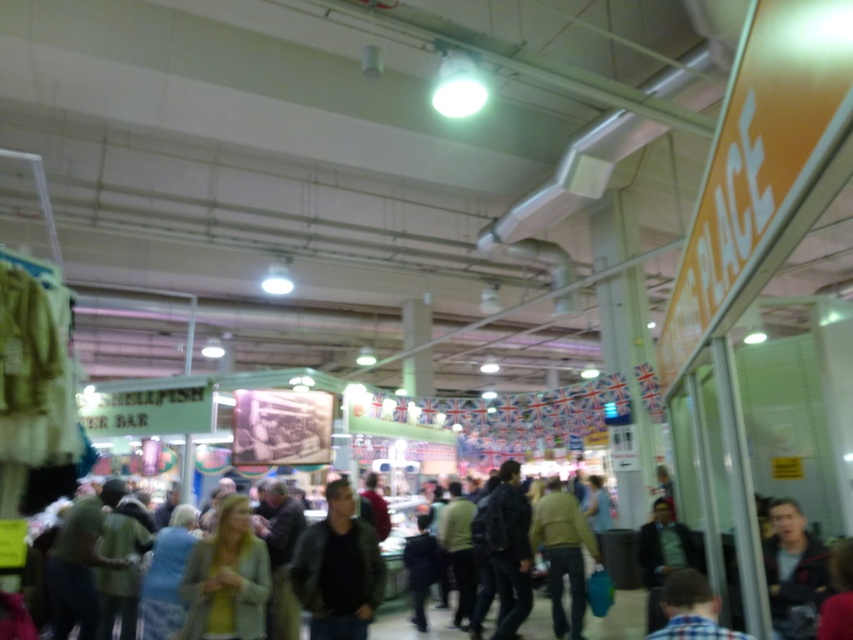
You are a customer in the market and want to find the dark brown leather jacket at center. According to the coordinates given, where exactly is it located in the image?

The dark brown leather jacket at center is located at coordinates point (338,570).

Based on the photo, you are standing at the entrance of the market and see a dark gray jacket at center. If you want to reach the Shellfish Bar stall on the left, should you walk towards the jacket or away from it?

You should walk away from the dark gray jacket at center because the Shellfish Bar stall is on the left side of the image, while the jacket is at the center. Since the jacket is centrally located, moving away from it towards the left would lead you toward the Shellfish Bar stall.